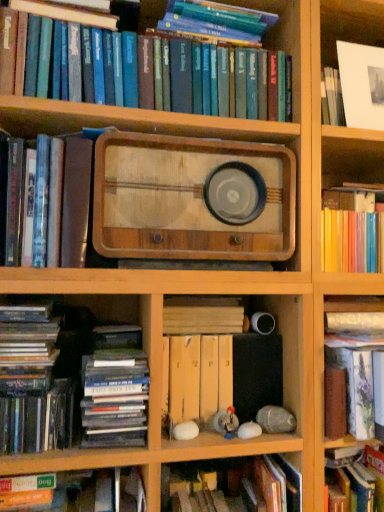
Question: From the image's perspective, relative to yellow cardboard file at center, the fourth book when ordered from bottom to top, is matte black book at lower left, which is the 4th book from top to bottom, above or below?

Choices:
 (A) below
 (B) above

Answer: (B)

Question: In terms of width, does matte black book at lower left, which is the 4th book from top to bottom, look wider or thinner when compared to yellow cardboard file at center, which is the 6th book in top-to-bottom order?

Choices:
 (A) thin
 (B) wide

Answer: (B)

Question: Considering the real-world distances, which object is farthest from the hardcover book at lower left, acting as the second book starting from the bottom?

Choices:
 (A) hardcover books at upper center, placed as the ninth book when sorted from bottom to top
 (B) wooden plank at center, which is the seventh book in bottom-to-top order
 (C) hardcover book at left, positioned as the eighth book in bottom-to-top order
 (D) hardcover book at left, the 3th book from the bottom
 (E) wooden radio at center

Answer: (A)

Question: Which of these objects is positioned farthest from the white paper at upper right?

Choices:
 (A) white matte egg at lower center, the 1th book positioned from the bottom
 (B) hardcover books at upper center, placed as the ninth book when sorted from bottom to top
 (C) hardcover book at lower left, marked as the eighth book in a top-to-bottom arrangement
 (D) hardcover book at left, the 3th book from the bottom
 (E) wooden plank at center, which is the seventh book in bottom-to-top order

Answer: (C)